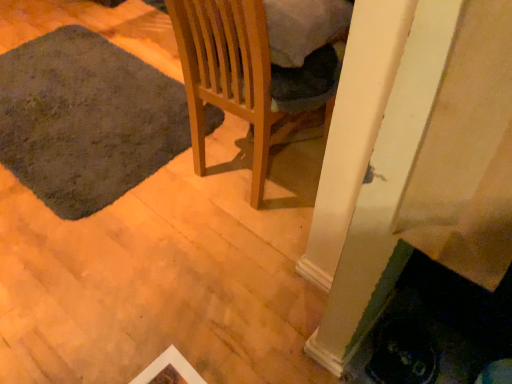
The image size is (512, 384). What are the coordinates of `space that is in front of dark gray carpet at lower left` in the screenshot? It's located at (121, 267).